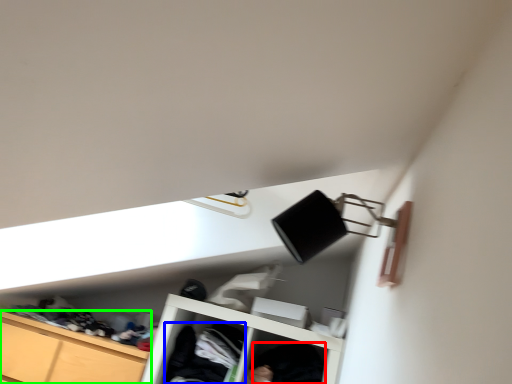
Question: Considering the real-world distances, which object is farthest from clothing (highlighted by a red box)? clothing (highlighted by a blue box) or cabinetry (highlighted by a green box)?

Choices:
 (A) clothing
 (B) cabinetry

Answer: (B)